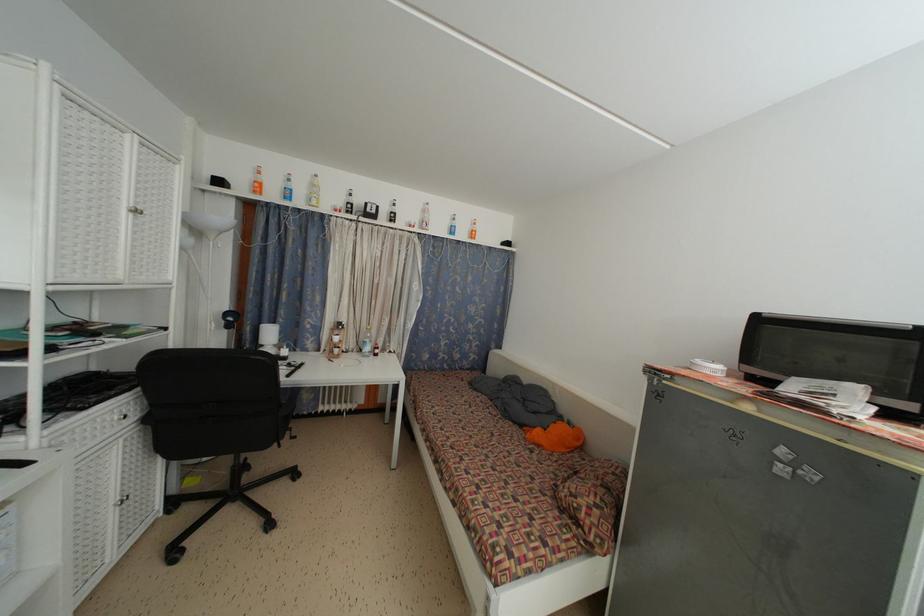
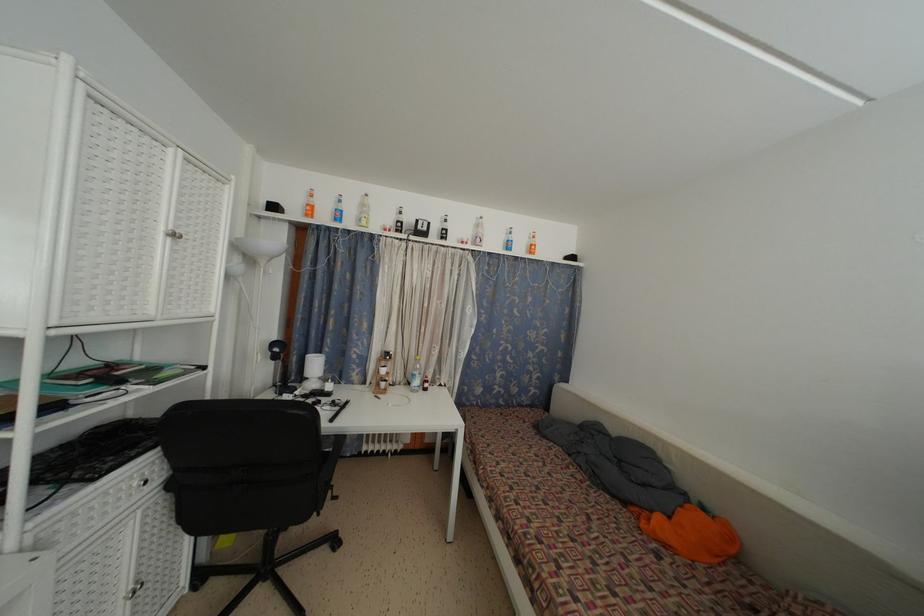
In the second image, find the point that corresponds to the point at 277,328 in the first image.

(323, 357)